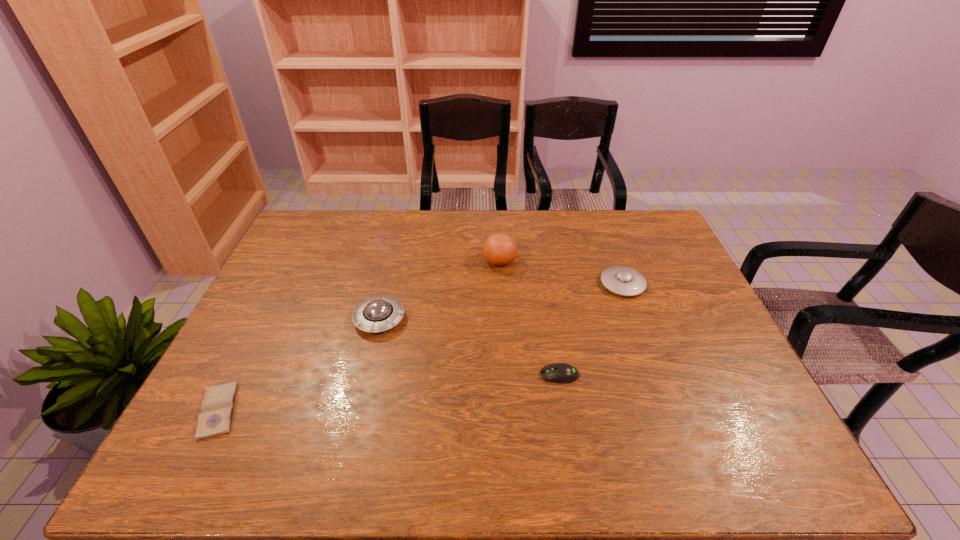
Where is `the tallest object`? This screenshot has width=960, height=540. the tallest object is located at coordinates (499, 249).

At what (x,y) coordinates should I click in order to perform the action: click on the third object from left to right. Please return your answer as a coordinate pair (x, y). The image size is (960, 540). Looking at the image, I should click on (499, 249).

Identify the location of the nearer saucer. (379, 313).

In order to click on the left saucer in this screenshot , I will do `click(379, 313)`.

Image resolution: width=960 pixels, height=540 pixels. Find the location of `the shorter saucer`. the shorter saucer is located at coordinates (620, 280).

Where is `the third tallest object`? The width and height of the screenshot is (960, 540). the third tallest object is located at coordinates (620, 280).

This screenshot has width=960, height=540. What are the coordinates of `computer mouse` in the screenshot? It's located at (562, 373).

Locate an element on the screen. the fourth farthest object is located at coordinates (562, 373).

This screenshot has width=960, height=540. I want to click on the shortest object, so click(x=215, y=418).

At what (x,y) coordinates should I click in order to perform the action: click on the nearest object. Please return your answer as a coordinate pair (x, y). Looking at the image, I should click on (215, 418).